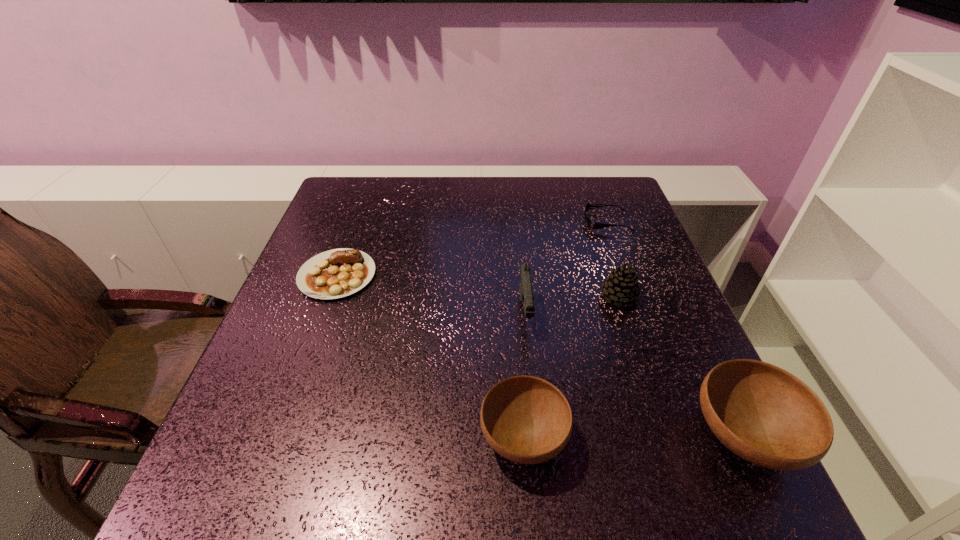
Locate an element on the screen. object that is at the left edge is located at coordinates (337, 273).

Locate an element on the screen. Image resolution: width=960 pixels, height=540 pixels. bowl that is at the right edge is located at coordinates (762, 413).

Where is `sunglasses at the right edge`? sunglasses at the right edge is located at coordinates click(591, 225).

This screenshot has height=540, width=960. I want to click on pinecone that is positioned at the right edge, so click(x=621, y=286).

What are the coordinates of `object at the far right corner` in the screenshot? It's located at (591, 225).

At what (x,y) coordinates should I click in order to perform the action: click on object situated at the near right corner. Please return your answer as a coordinate pair (x, y). Looking at the image, I should click on (762, 413).

Image resolution: width=960 pixels, height=540 pixels. I want to click on free space at the far edge, so click(x=561, y=177).

Where is `vacant space at the left edge of the desktop`? This screenshot has width=960, height=540. vacant space at the left edge of the desktop is located at coordinates (313, 242).

Locate an element on the screen. This screenshot has height=540, width=960. free space at the right edge is located at coordinates (687, 374).

Locate an element on the screen. vacant position at the far left corner of the desktop is located at coordinates click(x=358, y=206).